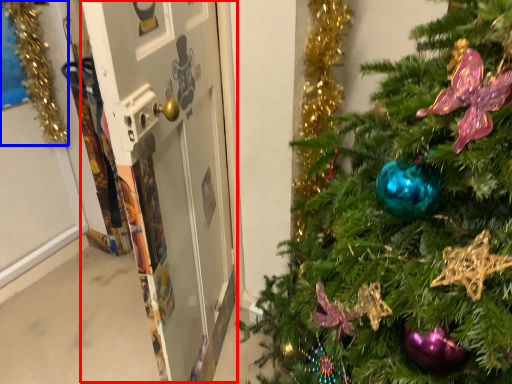
Question: Which object is closer to the camera taking this photo, screen door (highlighted by a red box) or christmas decoration (highlighted by a blue box)?

Choices:
 (A) screen door
 (B) christmas decoration

Answer: (A)